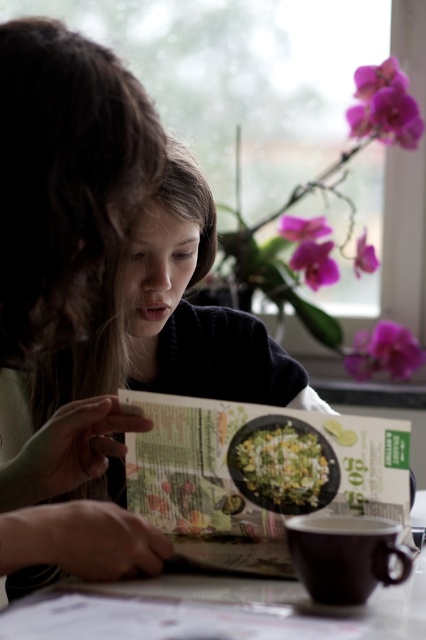
Question: Estimate the real-world distances between objects in this image. Which object is closer to the matte black book at center?

Choices:
 (A) green leafy vegetables at center
 (B) smooth black hair at center
 (C) white glossy table at lower center
 (D) printed paper book at center

Answer: (D)

Question: Considering the relative positions of smooth black hair at center and green leafy vegetables at center in the image provided, where is smooth black hair at center located with respect to green leafy vegetables at center?

Choices:
 (A) below
 (B) above

Answer: (B)

Question: Among these objects, which one is nearest to the camera?

Choices:
 (A) smooth black hair at center
 (B) white glossy table at lower center
 (C) green leafy vegetables at center

Answer: (B)

Question: Does matte black book at center have a greater width compared to smooth black hair at center?

Choices:
 (A) no
 (B) yes

Answer: (A)

Question: From the image, what is the correct spatial relationship of matte black book at center in relation to smooth black hair at center?

Choices:
 (A) left
 (B) right

Answer: (A)

Question: Which point is closer to the camera taking this photo?

Choices:
 (A) (5, 92)
 (B) (359, 378)
 (C) (129, 451)
 (D) (276, 476)

Answer: (A)